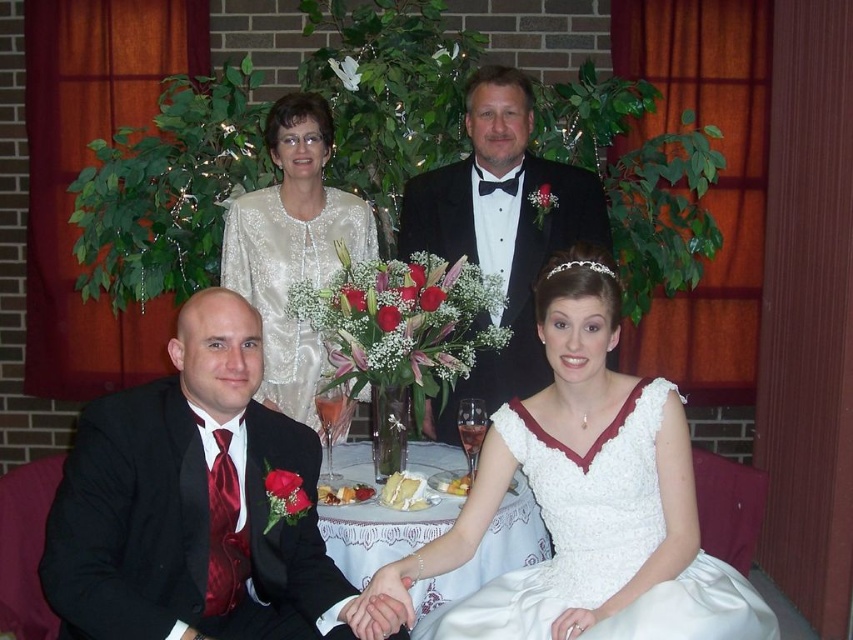
Consider the image. You are a photographer at the wedding reception. You need to position yourself so that both the white satin dress at lower center and the matte black tuxedo at upper center are fully visible in your shot. Which direction should you move to ensure both are visible without cropping either?

To ensure both the white satin dress at lower center and the matte black tuxedo at upper center are fully visible, you should move to the side where the white satin dress at lower center is wider than the matte black tuxedo at upper center, allowing the dress to occupy more space without cropping either.

From the picture: In the wedding reception scene, there is a white satin dress at lower center and a matte black tuxedo at upper center. From the perspective of someone standing at the entrance facing the scene, which object is positioned to the right?

The white satin dress at lower center is positioned to the right of the matte black tuxedo at upper center.

You are a photographer at a wedding reception. You need to capture a closeup shot of the shiny red tie at lower left and the white satin dress at lower center. The camera you are using has a minimum focus distance of 18 inches. Can you take the photo without moving either object?

The distance between the shiny red tie at lower left and the white satin dress at lower center is 21.16 inches, which is greater than the camera minimum focus distance of 18 inches. Therefore, the photographer can take the closeup shot without moving either object.